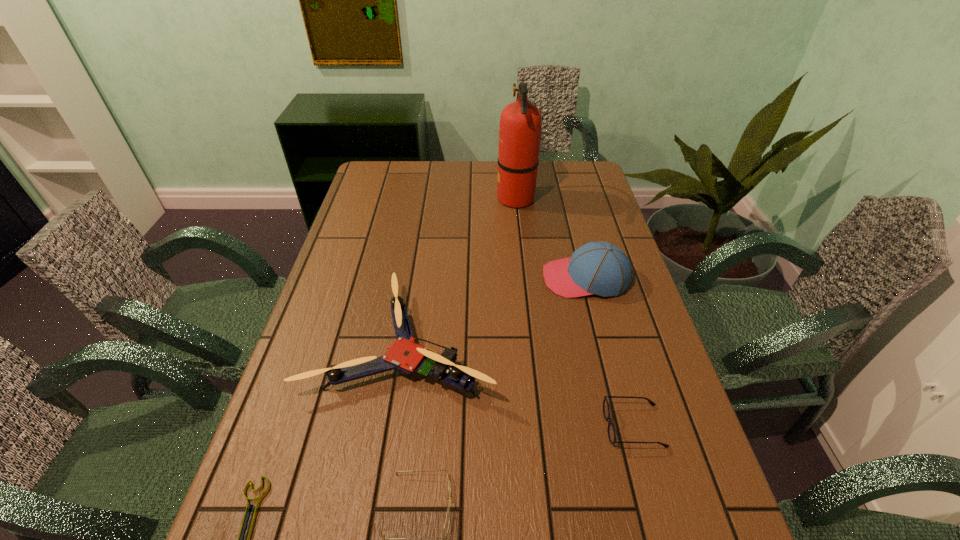
Find the location of a particular element. The image size is (960, 540). fire extinguisher is located at coordinates (520, 122).

You are a GUI agent. You are given a task and a screenshot of the screen. Output one action in this format:
    pyautogui.click(x=<x>, y=<y>)
    Task: Click on the farthest object
    
    Given the screenshot: What is the action you would take?
    pyautogui.click(x=520, y=122)

At what (x,y) coordinates should I click in order to perform the action: click on baseball cap. Please return your answer as a coordinate pair (x, y). Image resolution: width=960 pixels, height=540 pixels. Looking at the image, I should click on (598, 267).

Find the location of `the fourth shortest object`. the fourth shortest object is located at coordinates (405, 355).

The image size is (960, 540). What are the coordinates of `the right spectacles` in the screenshot? It's located at (606, 411).

The width and height of the screenshot is (960, 540). I want to click on vacant area situated 0.330m on the side of the farthest object with the nozzle and handle, so click(x=407, y=198).

In order to click on vacant region located 0.320m on the side of the farthest object with the nozzle and handle in this screenshot , I will do `click(410, 198)`.

Identify the location of vacant region located on the side of the farthest object with the nozzle and handle. This screenshot has width=960, height=540. (407, 198).

Find the location of a particular element. vacant space located on the front-facing side of the second tallest object is located at coordinates (416, 278).

Where is `vacant region located on the front-facing side of the second tallest object`? vacant region located on the front-facing side of the second tallest object is located at coordinates (443, 278).